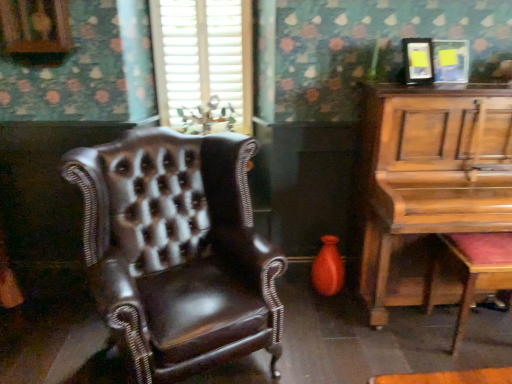
Where is `free space above white textured blinds at upper center (from a real-world perspective)`? This screenshot has width=512, height=384. free space above white textured blinds at upper center (from a real-world perspective) is located at coordinates (199, 1).